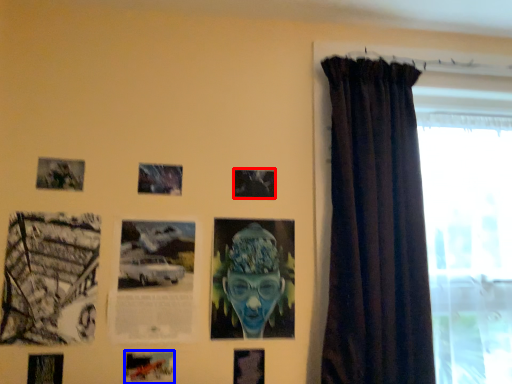
Question: Which object appears closest to the camera in this image, picture frame (highlighted by a red box) or picture frame (highlighted by a blue box)?

Choices:
 (A) picture frame
 (B) picture frame

Answer: (B)